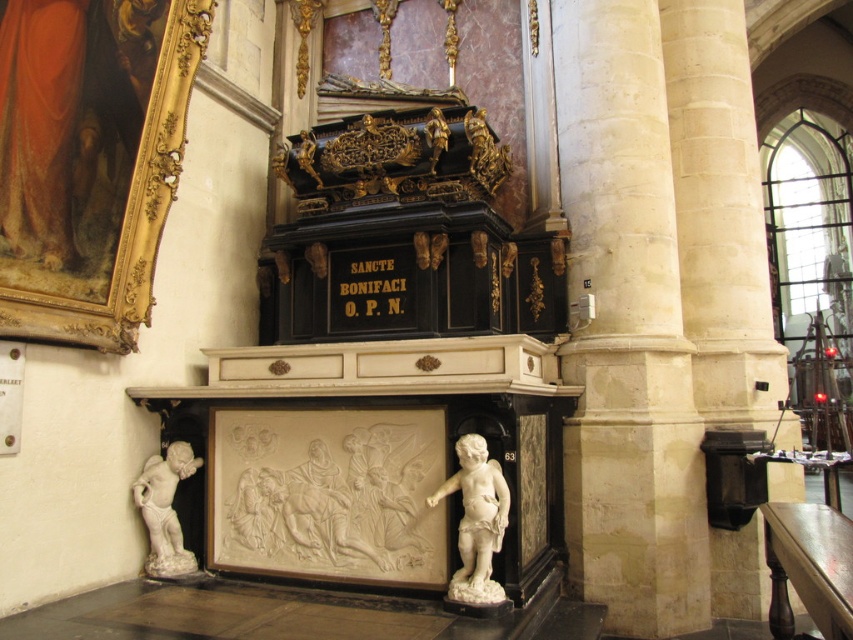
You are an interior designer planning to place a 1.5 meter wide sofa between the two cherubic statues flanking the plaque and the white marble fireplace at center. Will there be enough space for the sofa?

The two cherubic statues flanking the plaque and the white marble fireplace at center are 4.90 meters apart. Since the sofa is only 1.5 meters wide, there is sufficient space to place it between them.